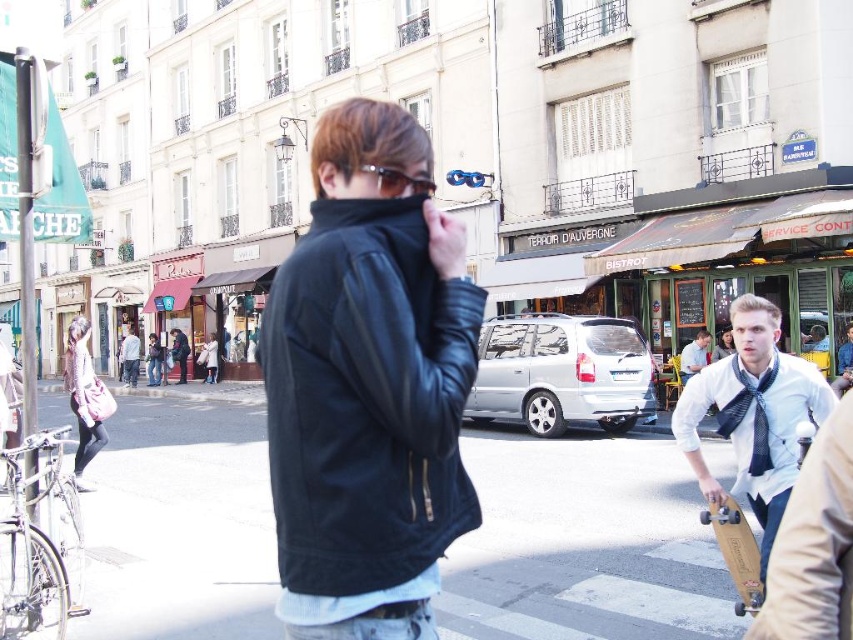
Can you confirm if wooden skateboard at lower right is smaller than light blue denim jacket at center?

Correct, wooden skateboard at lower right occupies less space than light blue denim jacket at center.

Between point (733, 573) and point (132, 349), which one is positioned in front?

Point (733, 573) is in front.

Is point (755, 572) positioned behind point (126, 330)?

No, (755, 572) is in front of (126, 330).

At what (x,y) coordinates should I click in order to perform the action: click on wooden skateboard at lower right. Please return your answer as a coordinate pair (x, y). Image resolution: width=853 pixels, height=640 pixels. Looking at the image, I should click on (735, 552).

Describe the element at coordinates (366, 400) in the screenshot. Image resolution: width=853 pixels, height=640 pixels. I see `black leather jacket at center` at that location.

Does black leather jacket at center appear on the left side of wooden skateboard at lower right?

Correct, you'll find black leather jacket at center to the left of wooden skateboard at lower right.

Is point (469, 502) farther from camera compared to point (740, 608)?

That is False.

The image size is (853, 640). In order to click on black leather jacket at center in this screenshot , I will do `click(366, 400)`.

Is the position of silver metallic van at center less distant than that of light blue denim jacket at center?

That is True.

Does silver metallic van at center have a lesser height compared to light blue denim jacket at center?

No.

This screenshot has width=853, height=640. What are the coordinates of `silver metallic van at center` in the screenshot? It's located at (561, 372).